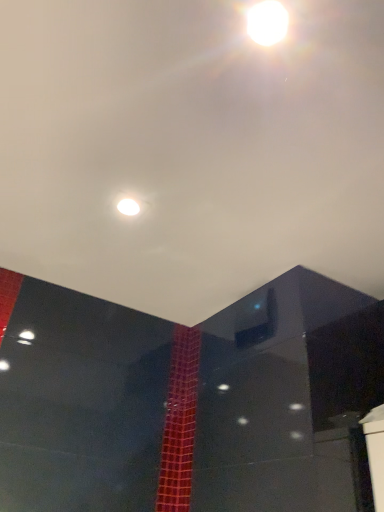
Question: Is white glossy light at upper center aimed at white glossy light at upper center?

Choices:
 (A) no
 (B) yes

Answer: (B)

Question: Can you confirm if white glossy light at upper center is shorter than white glossy light at upper center?

Choices:
 (A) no
 (B) yes

Answer: (A)

Question: From the image's perspective, is white glossy light at upper center on white glossy light at upper center?

Choices:
 (A) yes
 (B) no

Answer: (B)

Question: Can you confirm if white glossy light at upper center is wider than white glossy light at upper center?

Choices:
 (A) yes
 (B) no

Answer: (A)

Question: Can you confirm if white glossy light at upper center is taller than white glossy light at upper center?

Choices:
 (A) yes
 (B) no

Answer: (A)

Question: Considering the relative positions of white glossy light at upper center and white glossy light at upper center in the image provided, is white glossy light at upper center to the right of white glossy light at upper center from the viewer's perspective?

Choices:
 (A) no
 (B) yes

Answer: (A)

Question: Can you confirm if white glossy light at upper center is positioned to the right of white glossy light at upper center?

Choices:
 (A) no
 (B) yes

Answer: (B)

Question: From the image's perspective, is white glossy light at upper center located beneath white glossy light at upper center?

Choices:
 (A) no
 (B) yes

Answer: (A)

Question: Does white glossy light at upper center have a larger size compared to white glossy light at upper center?

Choices:
 (A) yes
 (B) no

Answer: (A)

Question: Are white glossy light at upper center and white glossy light at upper center beside each other?

Choices:
 (A) no
 (B) yes

Answer: (A)

Question: From the image's perspective, is white glossy light at upper center above white glossy light at upper center?

Choices:
 (A) no
 (B) yes

Answer: (B)

Question: Can you confirm if white glossy light at upper center is smaller than white glossy light at upper center?

Choices:
 (A) yes
 (B) no

Answer: (B)

Question: From a real-world perspective, relative to white glossy light at upper center, is white glossy light at upper center vertically above or below?

Choices:
 (A) above
 (B) below

Answer: (A)